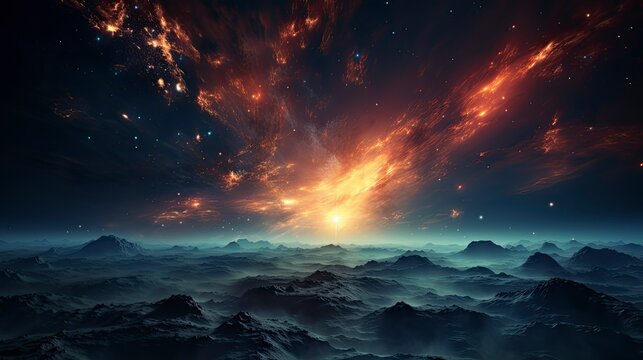
Identify the location of orange light. Image resolution: width=643 pixels, height=360 pixels. (357, 182).